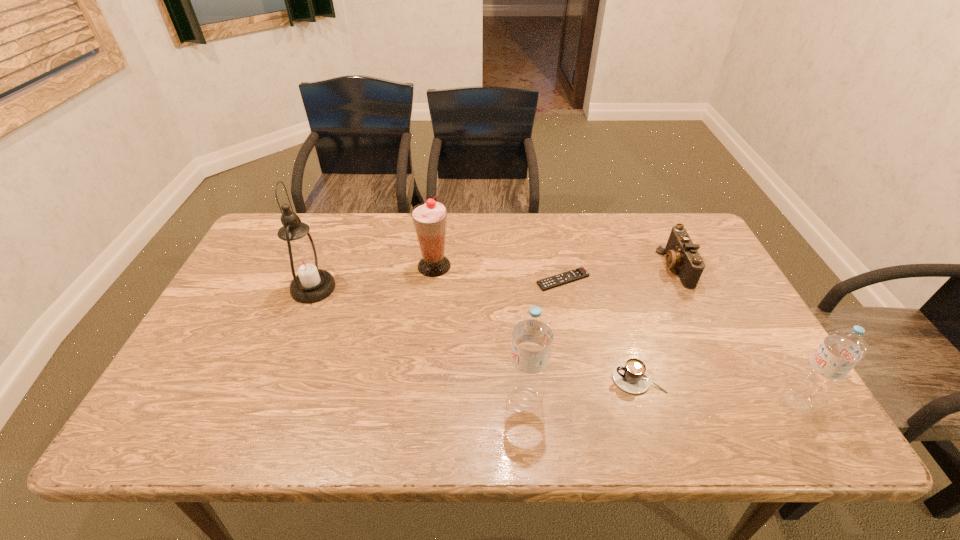
Identify the location of blank area located 0.150m with the handle on the side of the cappuccino. (549, 379).

The width and height of the screenshot is (960, 540). Find the location of `smoothie that is at the far edge`. smoothie that is at the far edge is located at coordinates (429, 218).

In order to click on camera situated at the far edge in this screenshot , I will do `click(682, 254)`.

Where is `cappuccino at the near edge`? cappuccino at the near edge is located at coordinates (631, 376).

Where is `water bottle that is at the right edge`? water bottle that is at the right edge is located at coordinates coord(841,349).

The width and height of the screenshot is (960, 540). I want to click on camera that is at the right edge, so point(682,254).

The image size is (960, 540). I want to click on object at the far right corner, so click(682, 254).

The image size is (960, 540). Identify the location of object that is at the near right corner. (841, 349).

Image resolution: width=960 pixels, height=540 pixels. In order to click on vacant region at the far edge of the desktop in this screenshot , I will do `click(490, 242)`.

Where is `vacant space at the near edge`? The height and width of the screenshot is (540, 960). vacant space at the near edge is located at coordinates (701, 391).